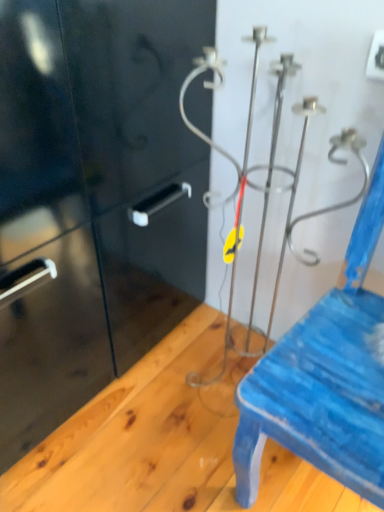
Image resolution: width=384 pixels, height=512 pixels. What do you see at coordinates (325, 377) in the screenshot?
I see `metal candle holder at right` at bounding box center [325, 377].

Where is `metal candle holder at right`? The height and width of the screenshot is (512, 384). metal candle holder at right is located at coordinates (325, 377).

In the scene shown: Measure the distance between point (346, 480) and camera.

Point (346, 480) and camera are 71.40 centimeters apart from each other.

What is the approximate width of metal candle holder at right?

It is 21.49 inches.

Where is `metal candle holder at right`? metal candle holder at right is located at coordinates (325, 377).